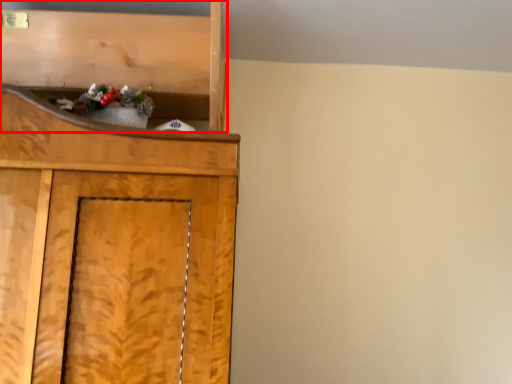
Question: From the image's perspective, considering the relative positions of shelf (annotated by the red box) and christmas decoration in the image provided, where is shelf (annotated by the red box) located with respect to the staircase?

Choices:
 (A) below
 (B) above

Answer: (B)